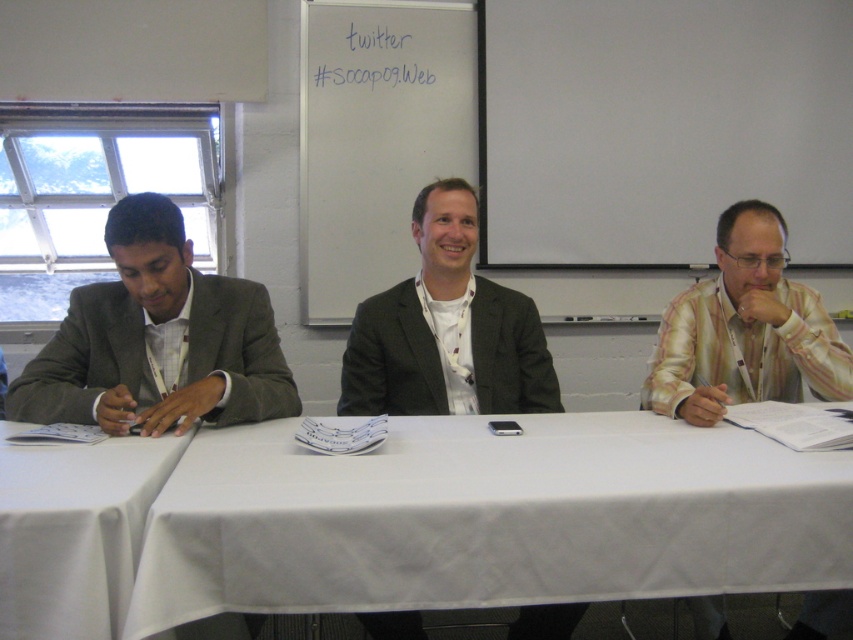
Question: Can you confirm if white cloth at left is smaller than matte gray suit at left?

Choices:
 (A) no
 (B) yes

Answer: (A)

Question: Which object is the closest to the white cloth at center?

Choices:
 (A) white cloth at left
 (B) matte gray suit at center
 (C) matte gray suit at left

Answer: (A)

Question: Which object is the closest to the white cloth at center?

Choices:
 (A) matte gray suit at left
 (B) white cloth at left

Answer: (B)

Question: Which point appears closest to the camera in this image?

Choices:
 (A) (44, 570)
 (B) (624, 465)
 (C) (279, 378)
 (D) (486, 314)

Answer: (A)

Question: Can you confirm if white cloth at center is smaller than white cloth at left?

Choices:
 (A) yes
 (B) no

Answer: (B)

Question: In this image, where is white cloth at center located relative to white cloth at left?

Choices:
 (A) below
 (B) above

Answer: (A)